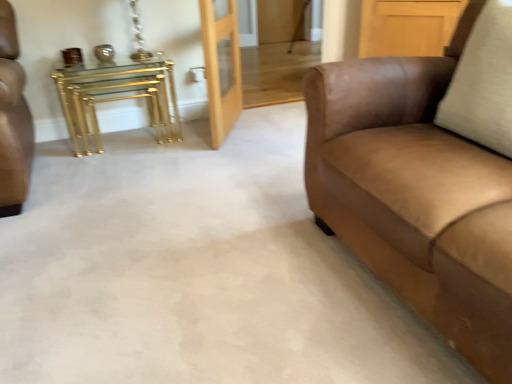
The width and height of the screenshot is (512, 384). Find the location of `gold metallic nesting tables at left`. gold metallic nesting tables at left is located at coordinates (117, 98).

This screenshot has height=384, width=512. What do you see at coordinates (117, 98) in the screenshot?
I see `gold metallic nesting tables at left` at bounding box center [117, 98].

You are a GUI agent. You are given a task and a screenshot of the screen. Output one action in this format:
    pyautogui.click(x=<x>, y=<y>)
    Task: Click on the gold metallic nesting tables at left
    
    Given the screenshot: What is the action you would take?
    click(117, 98)

Is light wood/glass door at center surrounding suede brown couch at right?

No, suede brown couch at right is not surrounded by light wood/glass door at center.

In the image, is light wood/glass door at center positioned in front of or behind suede brown couch at right?

Visually, light wood/glass door at center is located behind suede brown couch at right.

Which is more to the right, light wood/glass door at center or suede brown couch at right?

Positioned to the right is suede brown couch at right.

There is a light wood/glass door at center. In order to click on studio couch above it (from a real-world perspective) in this screenshot , I will do `click(416, 195)`.

Can you tell me how much suede brown couch at right and gold metallic nesting tables at left differ in facing direction?

90 degrees.

Considering the sizes of objects suede brown couch at right and gold metallic nesting tables at left in the image provided, who is shorter, suede brown couch at right or gold metallic nesting tables at left?

With less height is gold metallic nesting tables at left.

Can you see suede brown couch at right touching gold metallic nesting tables at left?

There is a gap between suede brown couch at right and gold metallic nesting tables at left.

Consider the image. Who is smaller, light wood/glass door at center or gold metallic nesting tables at left?

light wood/glass door at center is smaller.

What's the angular difference between light wood/glass door at center and gold metallic nesting tables at left's facing directions?

123 degrees.

Can you confirm if light wood/glass door at center is shorter than gold metallic nesting tables at left?

No.

Which object is thinner, light wood/glass door at center or gold metallic nesting tables at left?

light wood/glass door at center.

Do you think gold metallic nesting tables at left is within light wood/glass door at center, or outside of it?

gold metallic nesting tables at left lies outside light wood/glass door at center.

This screenshot has width=512, height=384. Find the location of `table below the light wood/glass door at center (from the image's perspective)`. table below the light wood/glass door at center (from the image's perspective) is located at coordinates (117, 98).

Is suede brown couch at right in front of or behind light wood/glass door at center in the image?

Clearly, suede brown couch at right is in front of light wood/glass door at center.

From their relative heights in the image, would you say suede brown couch at right is taller or shorter than light wood/glass door at center?

suede brown couch at right is taller than light wood/glass door at center.

Consider the image. Is suede brown couch at right inside or outside of light wood/glass door at center?

suede brown couch at right is spatially situated outside light wood/glass door at center.

Is light wood/glass door at center at the back of suede brown couch at right?

No, suede brown couch at right is not facing away from light wood/glass door at center.

In terms of width, does gold metallic nesting tables at left look wider or thinner when compared to suede brown couch at right?

Considering their sizes, gold metallic nesting tables at left looks slimmer than suede brown couch at right.

The width and height of the screenshot is (512, 384). Find the location of `studio couch below the gold metallic nesting tables at left (from the image's perspective)`. studio couch below the gold metallic nesting tables at left (from the image's perspective) is located at coordinates (416, 195).

Is gold metallic nesting tables at left completely or partially outside of suede brown couch at right?

That's correct, gold metallic nesting tables at left is outside of suede brown couch at right.

Is gold metallic nesting tables at left to the right of suede brown couch at right from the viewer's perspective?

No.

Identify the location of door located behind the suede brown couch at right. This screenshot has width=512, height=384. (221, 65).

Locate an element on the screen. Image resolution: width=512 pixels, height=384 pixels. table directly beneath the suede brown couch at right (from a real-world perspective) is located at coordinates (117, 98).

Estimate the real-world distances between objects in this image. Which object is further from gold metallic nesting tables at left, light wood/glass door at center or suede brown couch at right?

suede brown couch at right is further to gold metallic nesting tables at left.

Consider the image. Considering their positions, is light wood/glass door at center positioned further to suede brown couch at right than gold metallic nesting tables at left?

Based on the image, gold metallic nesting tables at left appears to be further to suede brown couch at right.

From the image, which object appears to be farther from light wood/glass door at center, gold metallic nesting tables at left or suede brown couch at right?

The object further to light wood/glass door at center is suede brown couch at right.

Looking at the image, which one is located closer to suede brown couch at right, gold metallic nesting tables at left or light wood/glass door at center?

light wood/glass door at center is positioned closer to the anchor suede brown couch at right.

When comparing their distances from light wood/glass door at center, does suede brown couch at right or gold metallic nesting tables at left seem further?

suede brown couch at right.

Which object lies further to the anchor point gold metallic nesting tables at left, suede brown couch at right or light wood/glass door at center?

suede brown couch at right.

At what (x,y) coordinates should I click in order to perform the action: click on door between suede brown couch at right and gold metallic nesting tables at left from front to back. Please return your answer as a coordinate pair (x, y). Image resolution: width=512 pixels, height=384 pixels. Looking at the image, I should click on (221, 65).